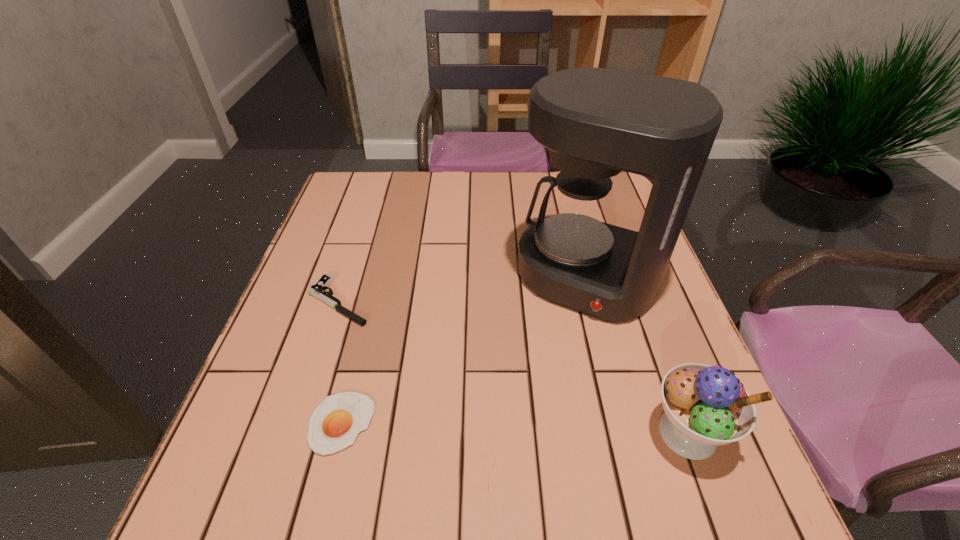
What are the coordinates of `free space on the desktop that is between the egg yolk and the icecream and is positioned on the front-facing side of the second shortest object` in the screenshot? It's located at (559, 429).

The width and height of the screenshot is (960, 540). I want to click on free spot on the desktop that is between the shortest object and the third shortest object and is positioned on the front-facing side of the tallest object, so click(x=511, y=428).